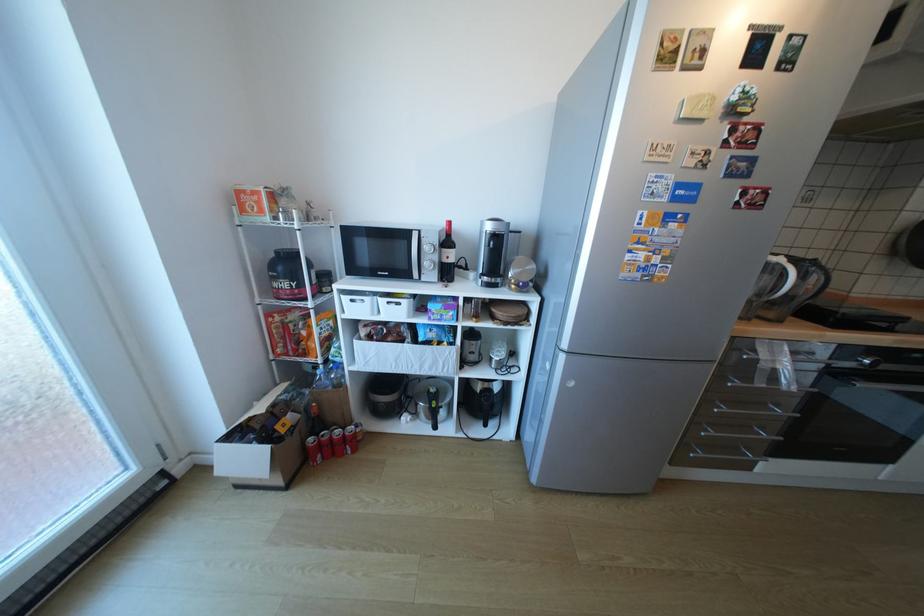
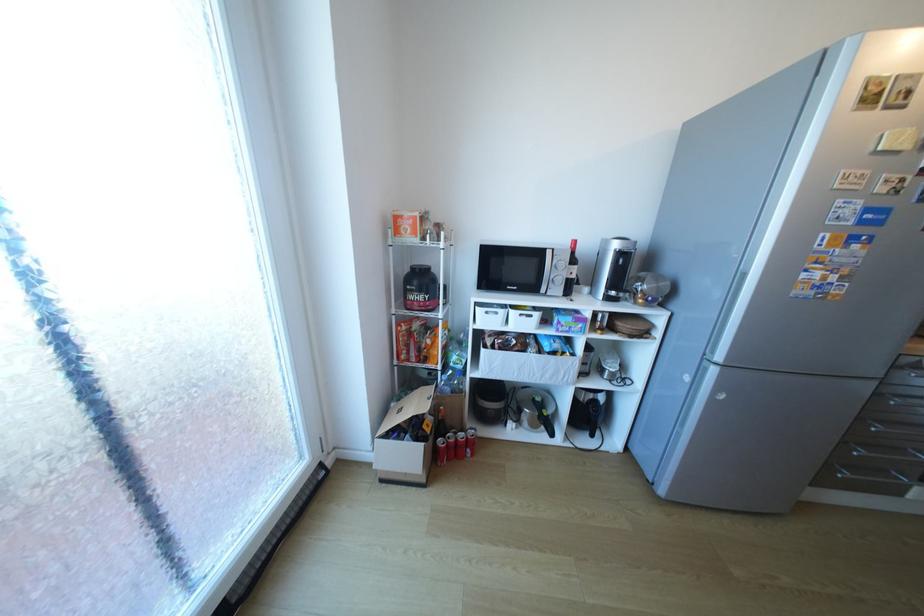
Locate, in the second image, the point that corresponds to point (387, 501) in the first image.

(523, 504)